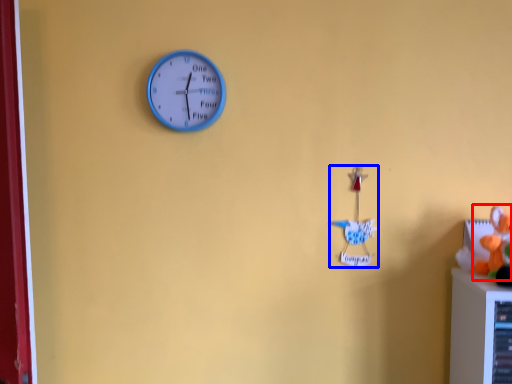
Question: Among these objects, which one is farthest to the camera, toy (highlighted by a red box) or toy (highlighted by a blue box)?

Choices:
 (A) toy
 (B) toy

Answer: (B)